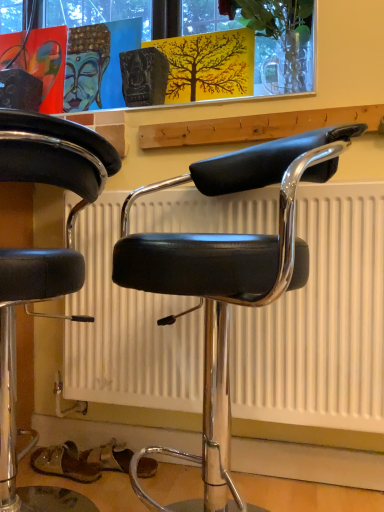
Question: From a real-world perspective, does translucent glass vase at upper center stand above black leather chair at center, which is counted as the 2th chair, starting from the left?

Choices:
 (A) no
 (B) yes

Answer: (B)

Question: Is the position of translucent glass vase at upper center more distant than that of black leather chair at center, which is counted as the 2th chair, starting from the left?

Choices:
 (A) no
 (B) yes

Answer: (B)

Question: Does translucent glass vase at upper center have a larger size compared to black leather chair at center, which is the 1th chair from right to left?

Choices:
 (A) yes
 (B) no

Answer: (B)

Question: Is there a large distance between translucent glass vase at upper center and black leather chair at center, which is the 1th chair from right to left?

Choices:
 (A) no
 (B) yes

Answer: (A)

Question: Does translucent glass vase at upper center touch black leather chair at center, which is the 1th chair from right to left?

Choices:
 (A) no
 (B) yes

Answer: (A)

Question: From the image's perspective, is black leather chair at center, which is counted as the 2th chair, starting from the left, above or below translucent glass vase at upper center?

Choices:
 (A) below
 (B) above

Answer: (A)

Question: Based on their sizes in the image, would you say black leather chair at center, which is the 1th chair from right to left, is bigger or smaller than translucent glass vase at upper center?

Choices:
 (A) big
 (B) small

Answer: (A)

Question: From a real-world perspective, is black leather chair at center, which is the 1th chair from right to left, physically located above or below translucent glass vase at upper center?

Choices:
 (A) below
 (B) above

Answer: (A)

Question: Is black leather chair at center, which is the 1th chair from right to left, spatially inside translucent glass vase at upper center, or outside of it?

Choices:
 (A) outside
 (B) inside

Answer: (A)

Question: Is translucent glass vase at upper center wider or thinner than black leather stool at left, marked as the 1th chair in a left-to-right arrangement?

Choices:
 (A) thin
 (B) wide

Answer: (A)

Question: Considering the positions of translucent glass vase at upper center and black leather stool at left, which is counted as the 2th chair, starting from the right, in the image, is translucent glass vase at upper center bigger or smaller than black leather stool at left, which is counted as the 2th chair, starting from the right,?

Choices:
 (A) small
 (B) big

Answer: (A)

Question: Based on their positions, is translucent glass vase at upper center located to the left or right of black leather stool at left, marked as the 1th chair in a left-to-right arrangement?

Choices:
 (A) right
 (B) left

Answer: (A)

Question: From a real-world perspective, is translucent glass vase at upper center above or below black leather stool at left, which is counted as the 2th chair, starting from the right?

Choices:
 (A) below
 (B) above

Answer: (B)

Question: In the image, is black leather stool at left, which is counted as the 2th chair, starting from the right, positioned in front of or behind black leather chair at center, which is the 1th chair from right to left?

Choices:
 (A) behind
 (B) front

Answer: (B)

Question: From the image's perspective, is black leather stool at left, marked as the 1th chair in a left-to-right arrangement, located above or below black leather chair at center, which is counted as the 2th chair, starting from the left?

Choices:
 (A) above
 (B) below

Answer: (B)